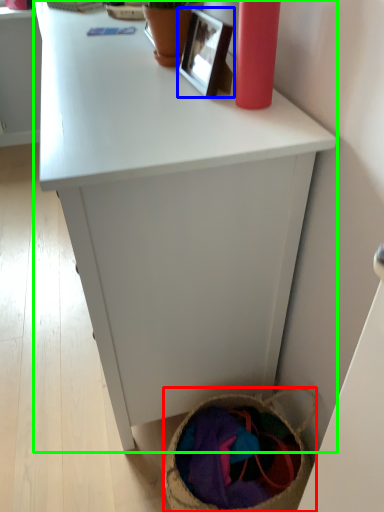
Question: Based on their relative distances, which object is farther from basket (highlighted by a red box)? Choose from picture frame (highlighted by a blue box) and desk (highlighted by a green box).

Choices:
 (A) picture frame
 (B) desk

Answer: (A)